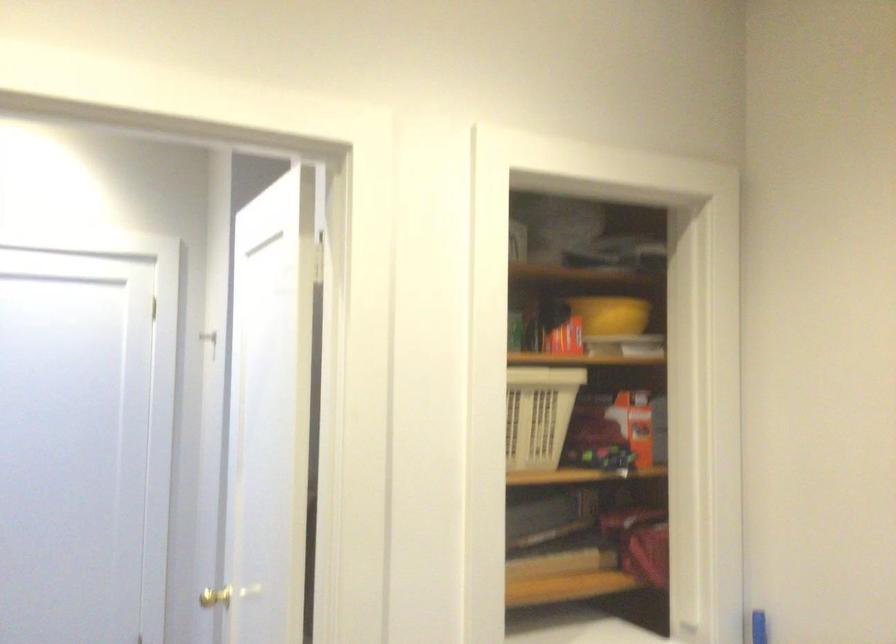
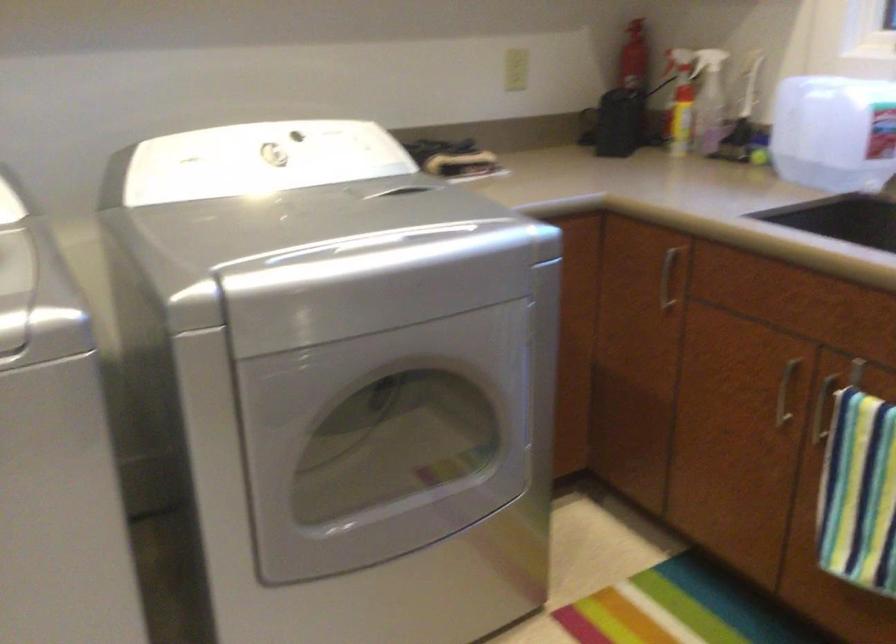
How did the camera likely rotate?

The camera rotated toward right-down.